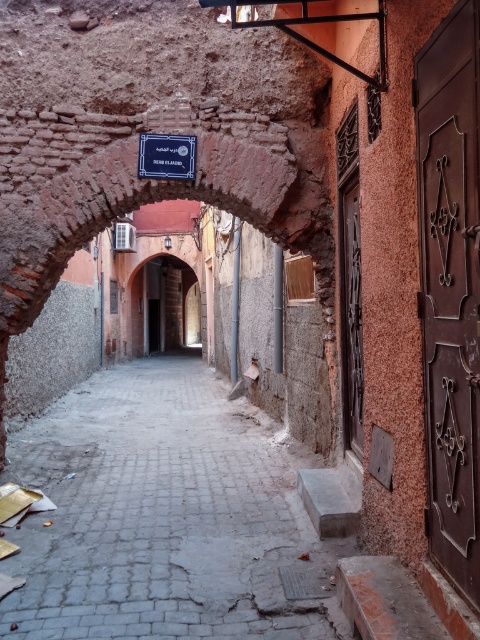
Who is taller, gray concrete alley at center or rustic stone archway at center?

Standing taller between the two is rustic stone archway at center.

Is gray concrete alley at center to the left of rustic stone archway at center from the viewer's perspective?

In fact, gray concrete alley at center is to the right of rustic stone archway at center.

What do you see at coordinates (164, 515) in the screenshot?
I see `gray concrete alley at center` at bounding box center [164, 515].

Where is `gray concrete alley at center`? gray concrete alley at center is located at coordinates (164, 515).

Can you confirm if gray concrete alley at center is shorter than blue metallic sign at center?

Yes.

Which of these two, gray concrete alley at center or blue metallic sign at center, stands shorter?

Standing shorter between the two is gray concrete alley at center.

What do you see at coordinates (164, 515) in the screenshot? This screenshot has width=480, height=640. I see `gray concrete alley at center` at bounding box center [164, 515].

Find the location of `gray concrete alley at center`. gray concrete alley at center is located at coordinates (164, 515).

Who is shorter, rustic stone archway at center or blue metallic sign at center?

Standing shorter between the two is blue metallic sign at center.

Is rustic stone archway at center positioned before blue metallic sign at center?

No, it is behind blue metallic sign at center.

Between point (156, 314) and point (168, 148), which one is positioned behind?

Positioned behind is point (156, 314).

At what (x,y) coordinates should I click in order to perform the action: click on rustic stone archway at center. Please return your answer as a coordinate pair (x, y). Looking at the image, I should click on (164, 305).